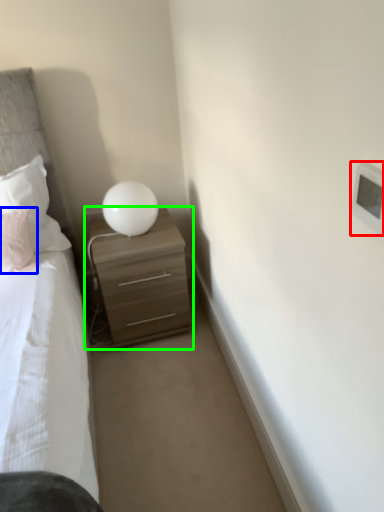
Question: Which object is the closest to the light switch (highlighted by a red box)? Choose among these: pillow (highlighted by a blue box) or nightstand (highlighted by a green box).

Choices:
 (A) pillow
 (B) nightstand

Answer: (B)